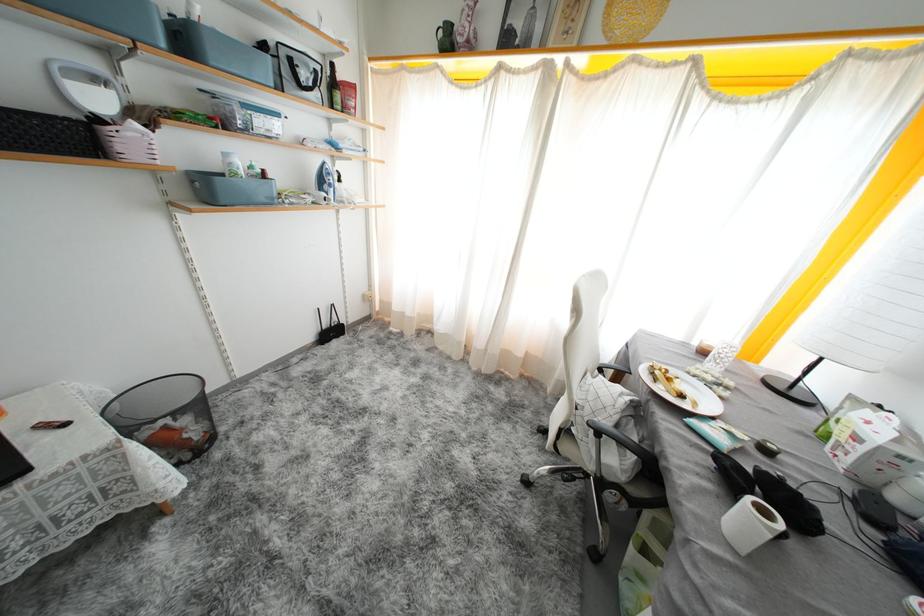
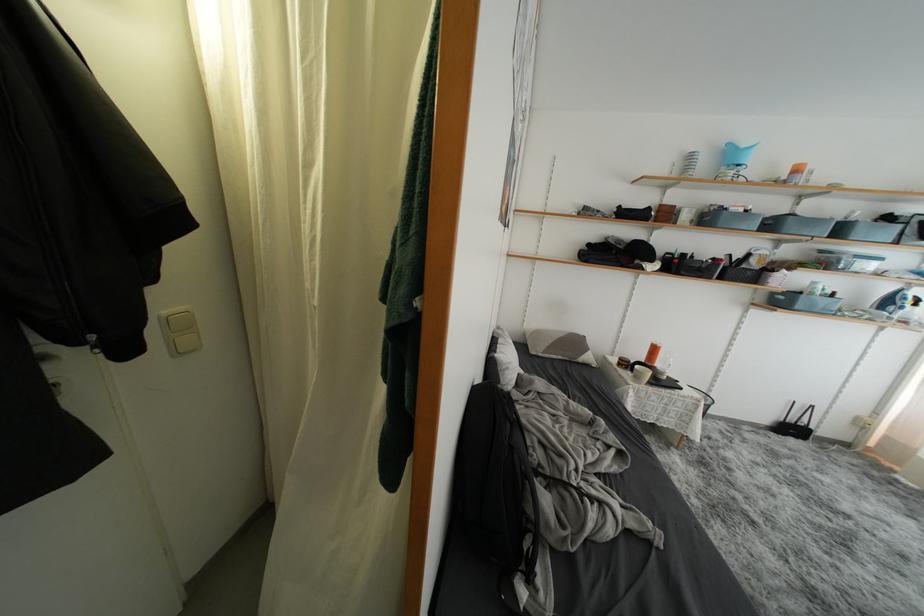
Where in the second image is the point corresponding to (190,44) from the first image?

(847, 235)